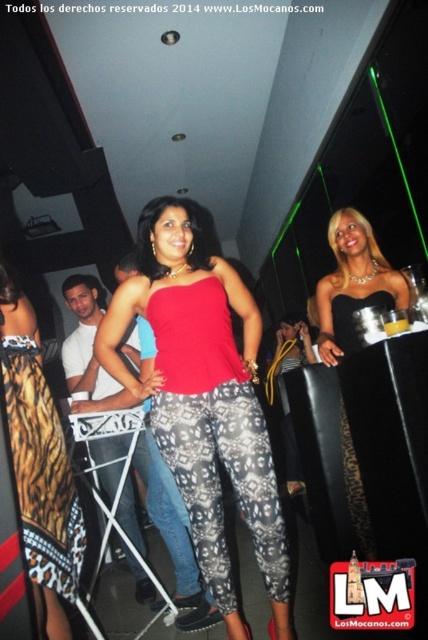
Does matte red tank top at center have a smaller size compared to printed fabric skirt at lower left?

Actually, matte red tank top at center might be larger than printed fabric skirt at lower left.

Between matte red tank top at center and printed fabric skirt at lower left, which one is positioned lower?

printed fabric skirt at lower left is below.

Is point (213, 504) farther from camera compared to point (39, 472)?

Yes, it is.

At what (x,y) coordinates should I click in order to perform the action: click on matte red tank top at center. Please return your answer as a coordinate pair (x, y). Looking at the image, I should click on (214, 433).

Is matte red tank top at center above black satin dress at center?

A: Incorrect, matte red tank top at center is not positioned above black satin dress at center.

Does matte red tank top at center lie behind black satin dress at center?

That is False.

Is point (281, 548) positioned behind point (362, 236)?

No, it is not.

This screenshot has width=428, height=640. I want to click on matte red tank top at center, so click(x=214, y=433).

Describe the element at coordinates (41, 472) in the screenshot. Image resolution: width=428 pixels, height=640 pixels. I see `printed fabric skirt at lower left` at that location.

Is printed fabric skirt at lower left below black satin dress at center?

Correct, printed fabric skirt at lower left is located below black satin dress at center.

Is point (39, 500) more distant than point (359, 298)?

No, (39, 500) is in front of (359, 298).

Locate an element on the screen. The height and width of the screenshot is (640, 428). printed fabric skirt at lower left is located at coordinates (41, 472).